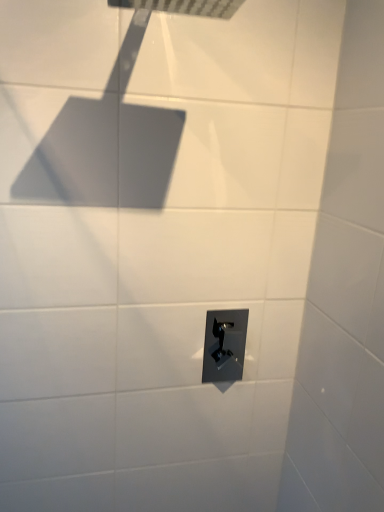
The width and height of the screenshot is (384, 512). What are the coordinates of `satin nickel switch at center` in the screenshot? It's located at (224, 345).

The image size is (384, 512). Describe the element at coordinates (224, 345) in the screenshot. I see `satin nickel switch at center` at that location.

Image resolution: width=384 pixels, height=512 pixels. Find the location of `satin nickel switch at center`. satin nickel switch at center is located at coordinates (224, 345).